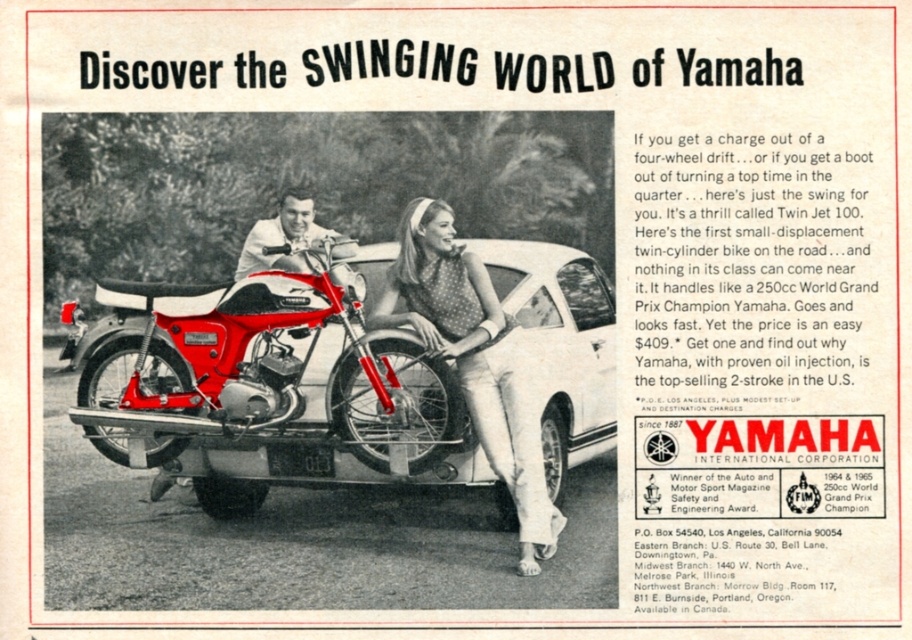
Measure the distance from white matte car at center to dotted fabric dress at center.

white matte car at center is 22.54 inches away from dotted fabric dress at center.

From the picture: Is white matte car at center further to the viewer compared to dotted fabric dress at center?

Yes.

This screenshot has width=912, height=640. What do you see at coordinates (338, 442) in the screenshot?
I see `white matte car at center` at bounding box center [338, 442].

The width and height of the screenshot is (912, 640). In order to click on white matte car at center in this screenshot , I will do `click(338, 442)`.

Is point (512, 387) in front of point (276, 243)?

Yes, it is.

Is dotted fabric dress at center to the right of shiny chrome handlebars at center from the viewer's perspective?

Indeed, dotted fabric dress at center is positioned on the right side of shiny chrome handlebars at center.

Who is more distant from viewer, (420,211) or (237,275)?

Positioned behind is point (237,275).

Identify the location of dotted fabric dress at center. (474, 360).

Does white matte car at center appear on the left side of shiny chrome handlebars at center?

Incorrect, white matte car at center is not on the left side of shiny chrome handlebars at center.

Consider the image. Does white matte car at center have a greater width compared to shiny chrome handlebars at center?

Correct, the width of white matte car at center exceeds that of shiny chrome handlebars at center.

Looking at this image, who is more forward, (550, 276) or (285, 214)?

Point (550, 276)

This screenshot has height=640, width=912. I want to click on white matte car at center, so click(x=338, y=442).